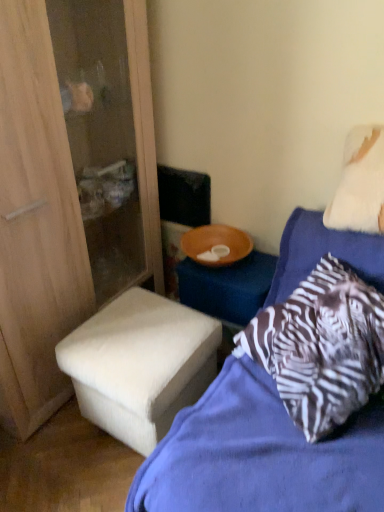
Question: Should I look upward or downward to see white fabric stool at lower left?

Choices:
 (A) down
 (B) up

Answer: (A)

Question: Is white fabric ottoman at lower left oriented away from white fluffy pillow at upper right?

Choices:
 (A) no
 (B) yes

Answer: (A)

Question: Could you tell me if white fabric ottoman at lower left is facing white fluffy pillow at upper right?

Choices:
 (A) no
 (B) yes

Answer: (B)

Question: Can you confirm if white fabric ottoman at lower left is positioned to the right of white fluffy pillow at upper right?

Choices:
 (A) no
 (B) yes

Answer: (A)

Question: Is white fabric ottoman at lower left positioned in front of white fluffy pillow at upper right?

Choices:
 (A) yes
 (B) no

Answer: (A)

Question: Is white fabric ottoman at lower left completely or partially outside of white fluffy pillow at upper right?

Choices:
 (A) yes
 (B) no

Answer: (A)

Question: From the image's perspective, does white fabric ottoman at lower left appear lower than white fluffy pillow at upper right?

Choices:
 (A) yes
 (B) no

Answer: (A)

Question: Is zebra-patterned pillow at upper right at the back of white fluffy pillow at upper right?

Choices:
 (A) yes
 (B) no

Answer: (B)

Question: From a real-world perspective, is white fluffy pillow at upper right on top of zebra-patterned pillow at upper right?

Choices:
 (A) yes
 (B) no

Answer: (A)

Question: Is white fluffy pillow at upper right wider than zebra-patterned pillow at upper right?

Choices:
 (A) yes
 (B) no

Answer: (B)

Question: From the image's perspective, is white fluffy pillow at upper right on top of zebra-patterned pillow at upper right?

Choices:
 (A) yes
 (B) no

Answer: (A)

Question: From a real-world perspective, does white fluffy pillow at upper right sit lower than zebra-patterned pillow at upper right?

Choices:
 (A) no
 (B) yes

Answer: (A)

Question: Is white fluffy pillow at upper right far from zebra-patterned pillow at upper right?

Choices:
 (A) yes
 (B) no

Answer: (B)

Question: From the image's perspective, is white fabric ottoman at lower left under white fabric stool at lower left?

Choices:
 (A) yes
 (B) no

Answer: (B)